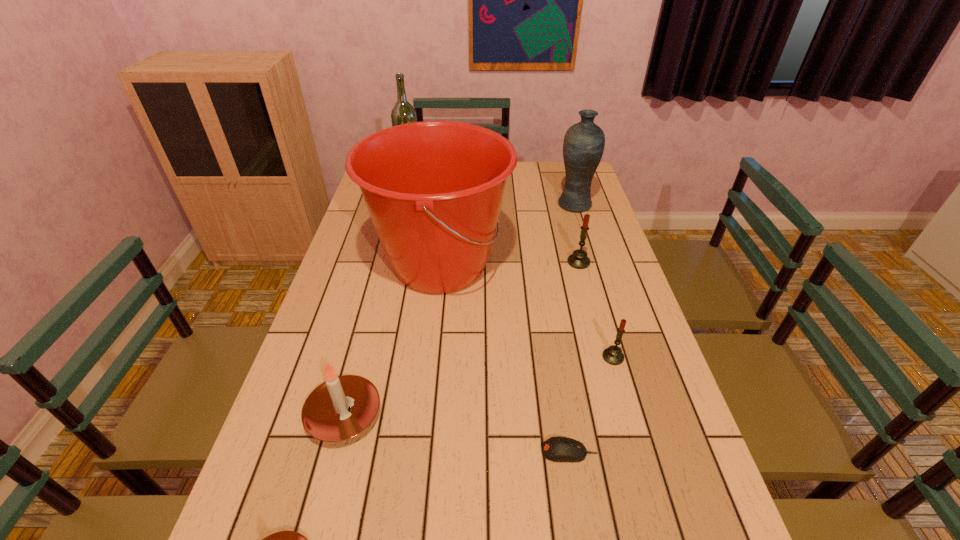
Identify the location of the farthest object. (403, 112).

The image size is (960, 540). In order to click on liquor in this screenshot , I will do `click(403, 112)`.

Locate an element on the screen. red bucket is located at coordinates (434, 189).

Where is `the seventh nearest object`? The height and width of the screenshot is (540, 960). the seventh nearest object is located at coordinates (584, 142).

Locate an element on the screen. blue vase is located at coordinates (584, 142).

I want to click on the bigger red candle, so click(578, 260).

I want to click on the farther red candle, so click(x=578, y=260).

Find the location of `the second nearest candle`. the second nearest candle is located at coordinates (340, 408).

Locate an element on the screen. the bigger white candle is located at coordinates (340, 408).

Locate an element on the screen. This screenshot has width=960, height=540. the nearer red candle is located at coordinates (613, 355).